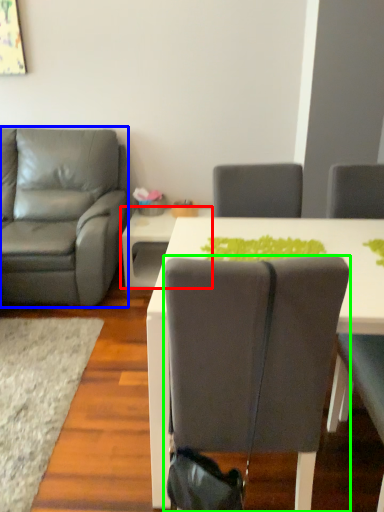
Question: Which is farther away from table (highlighted by a red box)? chair (highlighted by a blue box) or chair (highlighted by a green box)?

Choices:
 (A) chair
 (B) chair

Answer: (B)